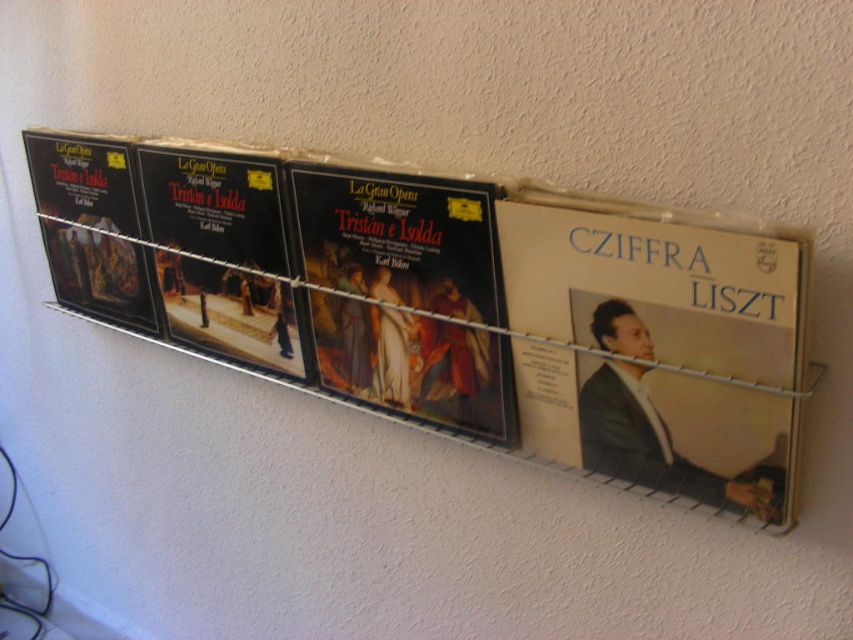
Question: Considering the real-world distances, which object is farthest from the black vinyl record at center?

Choices:
 (A) beige paper album at right
 (B) matte black vinyl record at center
 (C) matte black vinyl record at left

Answer: (A)

Question: Can you confirm if beige paper album at right is positioned below matte black vinyl record at center?

Choices:
 (A) yes
 (B) no

Answer: (A)

Question: Among these objects, which one is farthest from the camera?

Choices:
 (A) matte black vinyl record at center
 (B) black vinyl record at center

Answer: (B)

Question: Which of these objects is positioned farthest from the matte black vinyl record at left?

Choices:
 (A) matte black vinyl record at center
 (B) beige paper album at right
 (C) black vinyl record at center

Answer: (B)

Question: Can you confirm if matte black vinyl record at center is positioned to the left of black vinyl record at center?

Choices:
 (A) no
 (B) yes

Answer: (A)

Question: Can you confirm if beige paper album at right is smaller than matte black vinyl record at left?

Choices:
 (A) no
 (B) yes

Answer: (B)